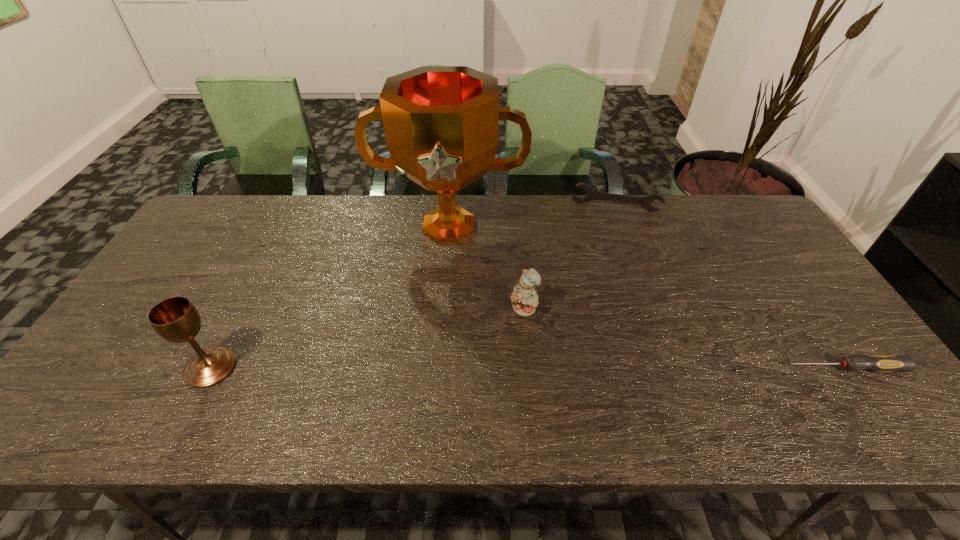
I want to click on vacant space situated 0.330m on the open ends of the fourth tallest object, so click(604, 282).

Identify the location of vacant region located 0.080m on the open ends of the fourth tallest object. (607, 228).

I want to click on award at the far edge, so click(441, 122).

The height and width of the screenshot is (540, 960). In order to click on wrench present at the far edge in this screenshot , I will do `click(592, 194)`.

Identify the location of chalice that is at the near edge. The image size is (960, 540). (175, 319).

In order to click on screwdriver that is at the near edge in this screenshot , I will do `click(876, 363)`.

In order to click on object situated at the right edge in this screenshot , I will do `click(876, 363)`.

The height and width of the screenshot is (540, 960). What are the coordinates of `object present at the near right corner` in the screenshot? It's located at (876, 363).

I want to click on vacant space at the far edge, so click(x=355, y=239).

Image resolution: width=960 pixels, height=540 pixels. Identify the location of free space at the near edge of the desktop. (589, 375).